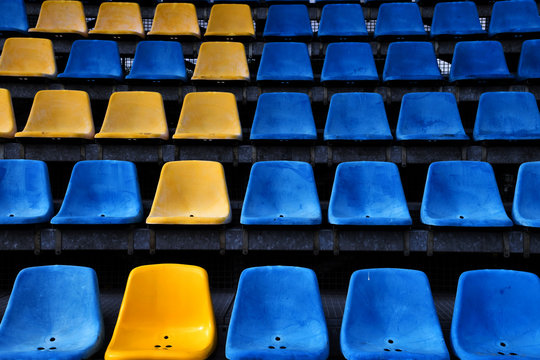
What are the coordinates of `chair in top row` in the screenshot? It's located at (17, 14), (52, 16), (123, 15), (166, 19), (230, 16), (297, 18), (347, 18), (392, 22), (462, 16), (508, 16).